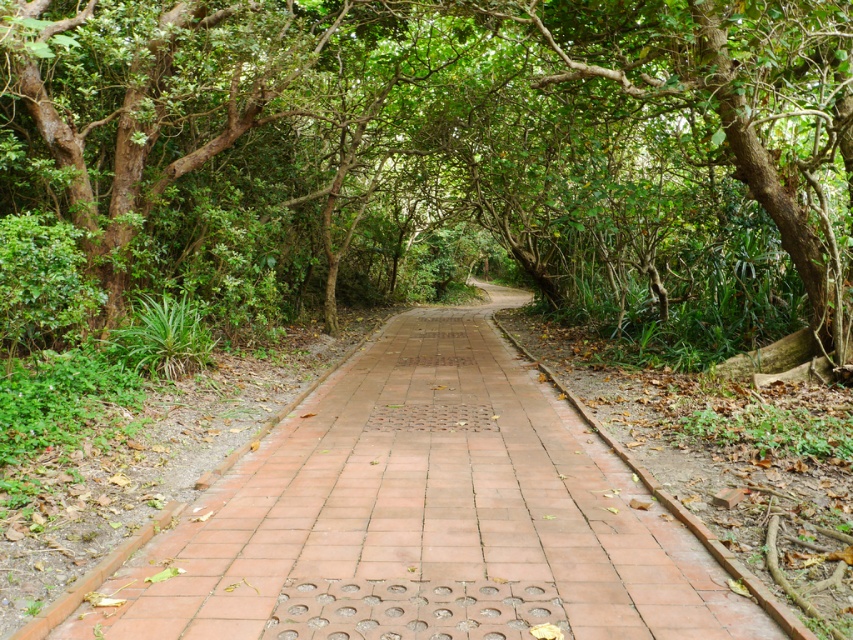
You are a hiker trying to take a photo of the green leafy tree at center and the terracotta brick pavement at center from the path. Since you want both subjects in focus, which one should you position closer to the camera to ensure they are both sharp?

The terracotta brick pavement at center is behind the green leafy tree at center, so you should position the camera closer to the green leafy tree at center to ensure both are in focus.

You are standing at the starting point of the forest pathway. There is a point marked at coordinates (x=447, y=150). Based on the scene description, what object is located at that point?

The point at coordinates (x=447, y=150) indicates a green leafy tree at center.

You are standing at the starting point of the pathway and want to reach the green leafy tree at center. Which direction should you walk to get there?

You should walk forward along the pathway since the green leafy tree at center is located at point (447,150), which is directly ahead on the path.